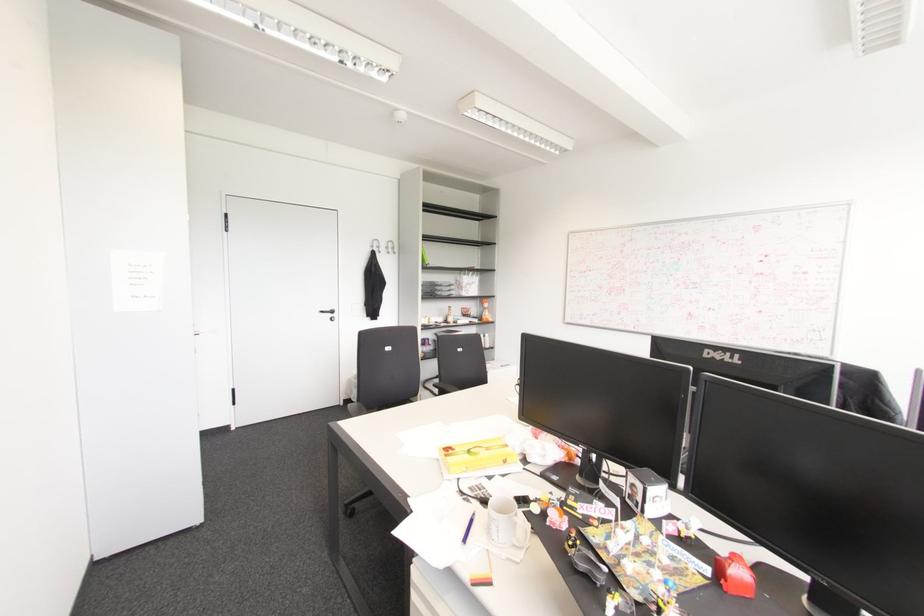
The width and height of the screenshot is (924, 616). What do you see at coordinates (330, 313) in the screenshot? I see `a black door handle` at bounding box center [330, 313].